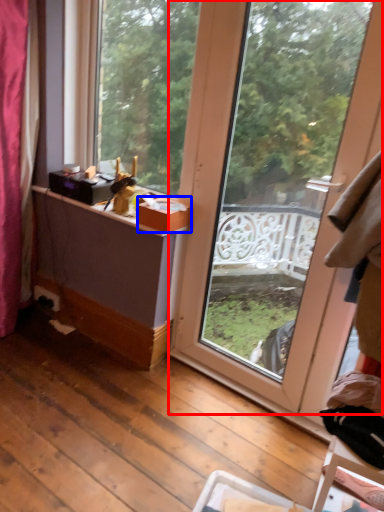
Question: Which object appears farthest to the camera in this image, window (highlighted by a red box) or box (highlighted by a blue box)?

Choices:
 (A) window
 (B) box

Answer: (B)